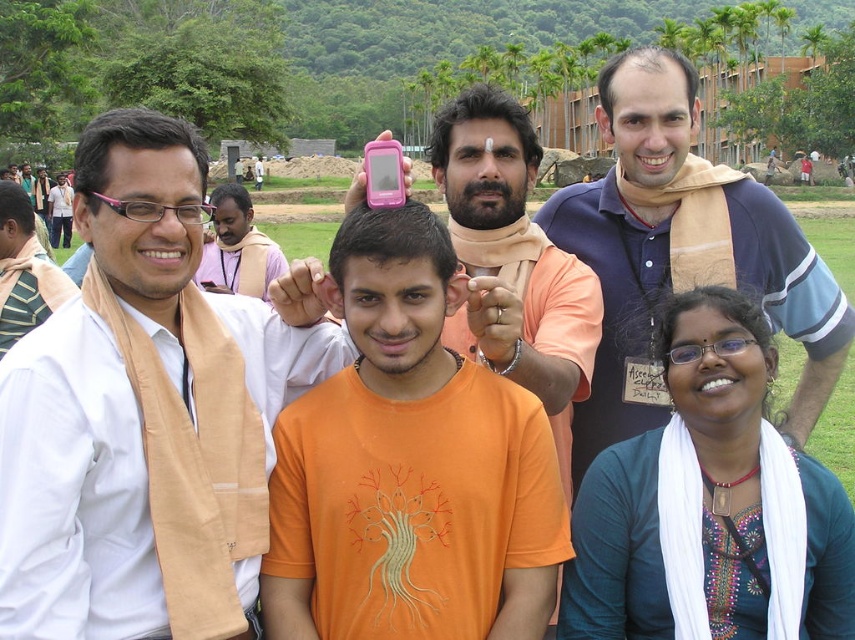
You are an observer standing in front of the group. You notice two people wearing cotton shirts. The person with the white cotton shirt at left is shorter than the blue cotton shirt at upper right. Which shirt is worn by the taller person?

The blue cotton shirt at upper right is worn by the taller person because the white cotton shirt at left is shorter than it.

You are organizing a photo shoot and need to position the white cotton shirt at left and the blue cotton shirt at upper right in a way that both are visible. Considering their sizes, which one should you place closer to the camera to ensure both are equally visible?

The white cotton shirt at left occupies less space than the blue cotton shirt at upper right, so you should place the white cotton shirt at left closer to the camera to ensure both appear equally visible.